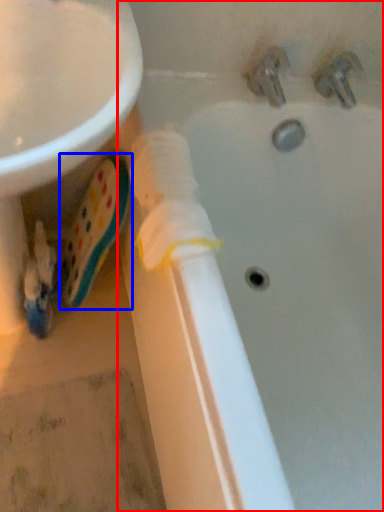
Question: Which object is closer to the camera taking this photo, bathtub (highlighted by a red box) or toothpaste (highlighted by a blue box)?

Choices:
 (A) bathtub
 (B) toothpaste

Answer: (A)